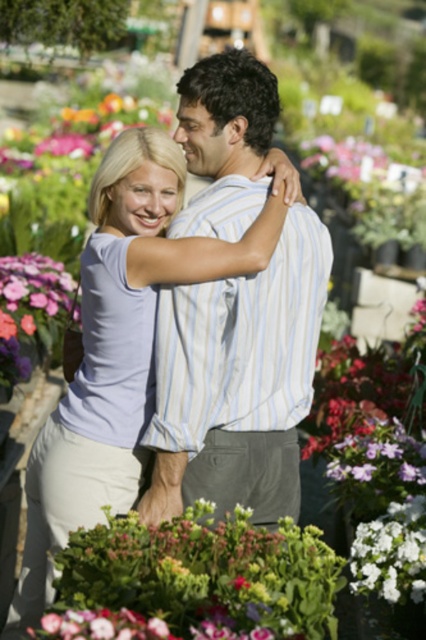
You are standing in a garden center and want to take a photo of a specific point in the scene. The point you want to focus on is labeled as point (134, 525). If your camera can focus clearly up to 3.5 meters away, will you need to adjust your position to capture this point sharply?

The distance of point (134, 525) from the camera is 3.63 meters. Since this exceeds the camera maximum focus range of 3.5 meters, you need to move closer to ensure the point is within the focus range.

You are a landscape designer planning to place a new bench in the garden center. The bench will be placed at coordinates point 0.908, 0.460. Is this location suitable for the bench, considering the green leafy plant at center is already there?

The green leafy plant at center is already positioned at point (x=195, y=580), so placing the bench at the same coordinates would not be suitable as it would overlap with the plant.

You are a gardener planning to arrange these plants in a display. Given the sizes of the green leafy plant at center and the pink matte flower at lower left, which one should be placed in the foreground to ensure visibility of both?

The green leafy plant at center is smaller, so placing it in the foreground will allow both plants to be visible, as the larger pink matte flower at lower left can be positioned slightly behind without blocking the smaller one.